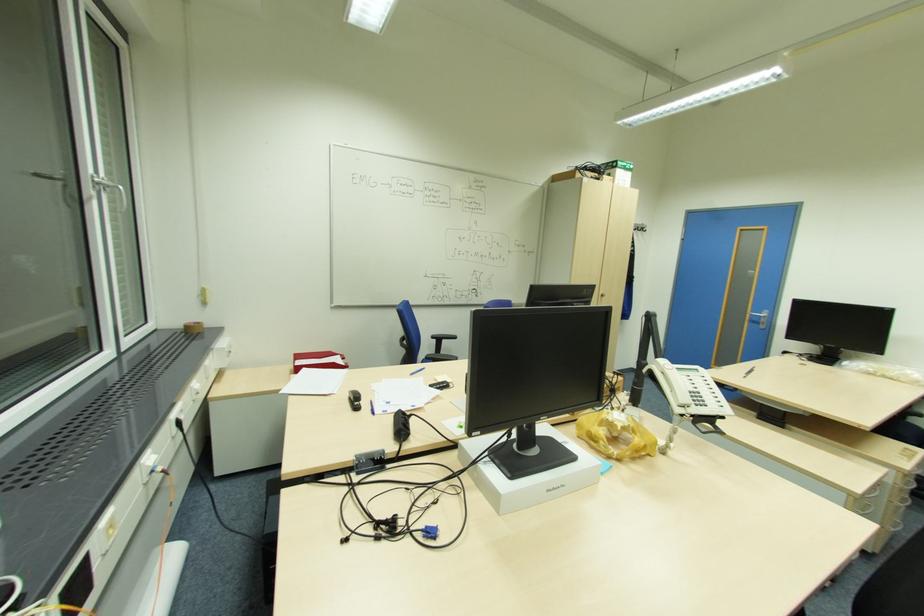
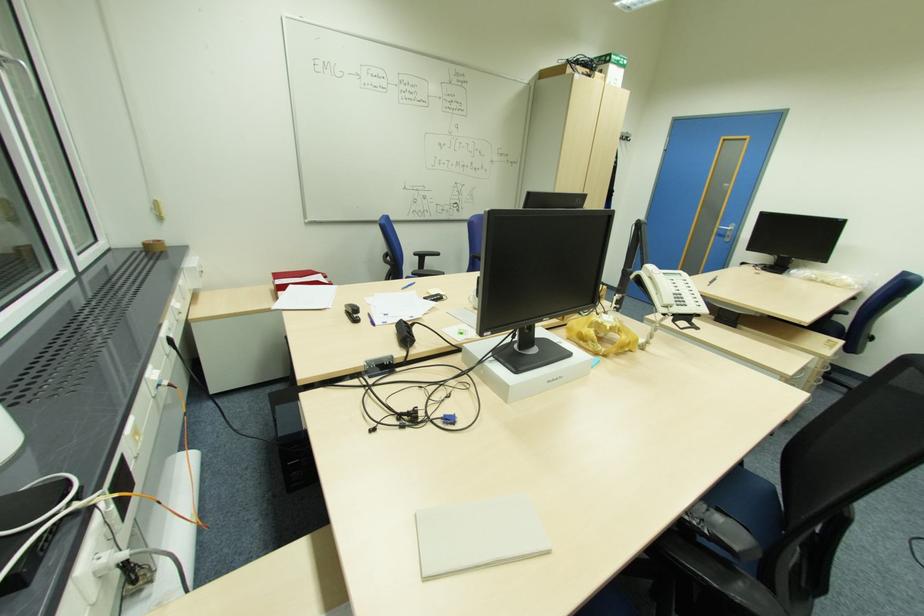
Locate, in the second image, the point that corresponds to the point at 201,323 in the first image.

(162, 241)